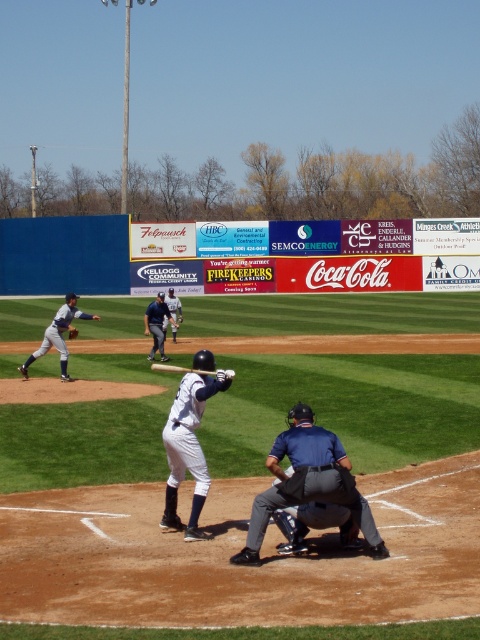
You are a photographer standing at the edge of the baseball field. You want to take a picture of the white matte uniform at center and the white uniform bat at center. Based on their sizes, which object should you focus on first if you want to capture both in the frame without zooming in or out?

The white matte uniform at center is shorter than the white uniform bat at center, so you should focus on the white matte uniform at center first to ensure both fit in the frame.